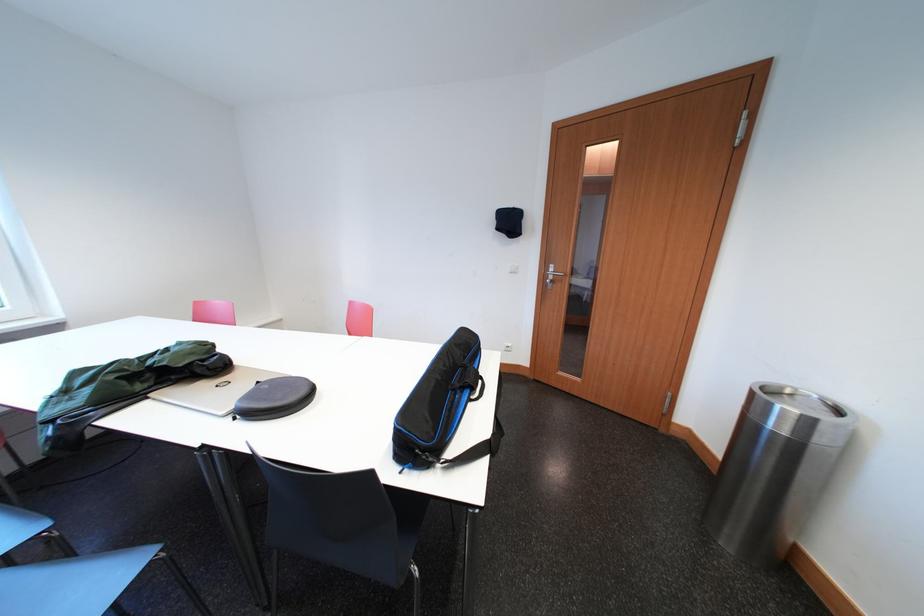
The width and height of the screenshot is (924, 616). I want to click on black hat, so click(508, 222).